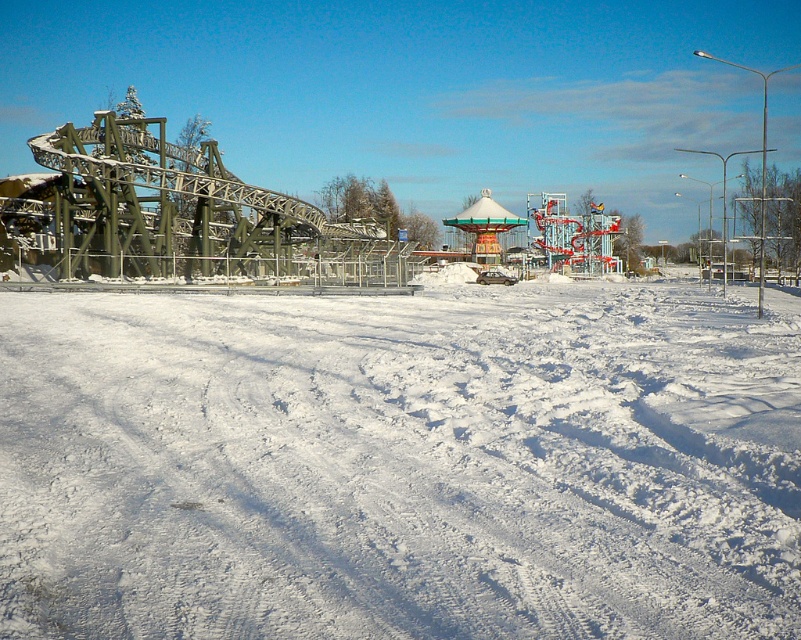
Question: From the image, what is the correct spatial relationship of white snow at lower center in relation to metal roller coaster at left?

Choices:
 (A) left
 (B) right

Answer: (B)

Question: Does white snow at lower center have a larger size compared to metal roller coaster at left?

Choices:
 (A) yes
 (B) no

Answer: (B)

Question: Does white snow at lower center appear on the left side of metal roller coaster at left?

Choices:
 (A) yes
 (B) no

Answer: (B)

Question: Which point appears closest to the camera in this image?

Choices:
 (A) (413, 381)
 (B) (151, 150)

Answer: (A)

Question: Which point appears farthest from the camera in this image?

Choices:
 (A) (596, 536)
 (B) (103, 218)

Answer: (B)

Question: Among these objects, which one is farthest from the camera?

Choices:
 (A) white snow at lower center
 (B) metal roller coaster at left

Answer: (B)